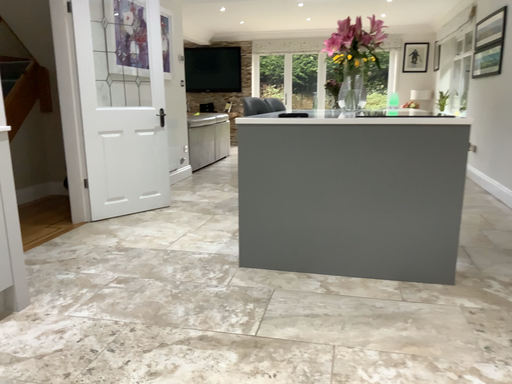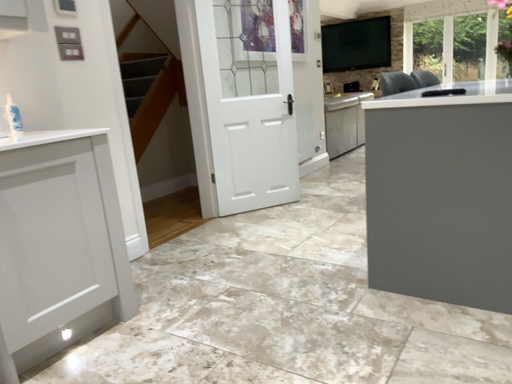
Question: How did the camera likely rotate when shooting the video?

Choices:
 (A) rotated right
 (B) rotated left

Answer: (B)